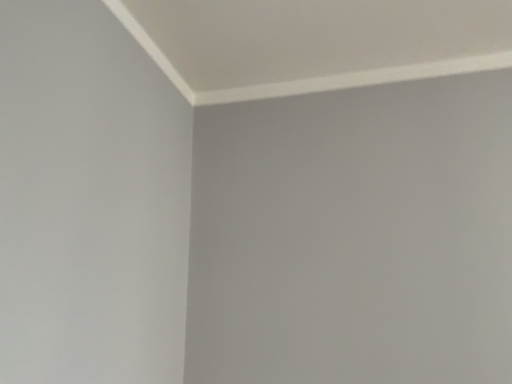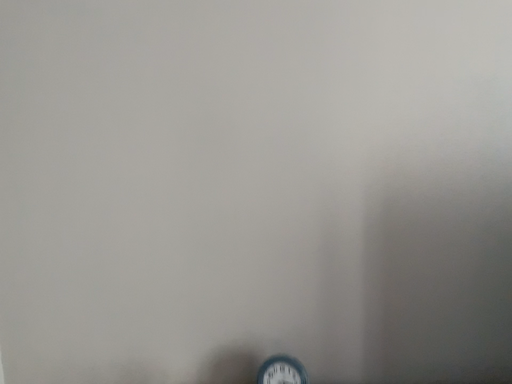
Question: Which way did the camera rotate in the video?

Choices:
 (A) rotated upward
 (B) rotated downward

Answer: (B)